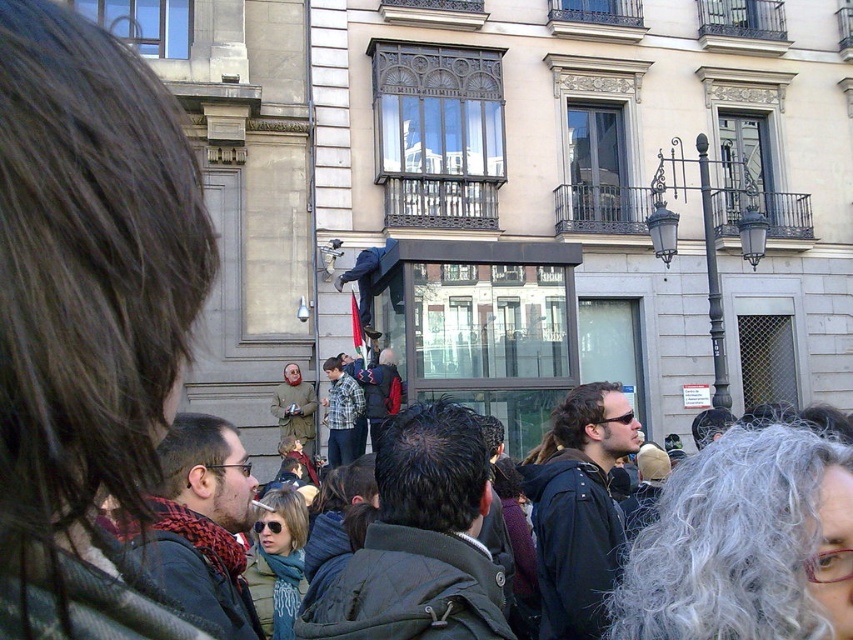
Question: Which point is closer to the camera?

Choices:
 (A) (425, 410)
 (B) (149, 572)
 (C) (399, 381)
 (D) (350, 435)

Answer: (B)

Question: Considering the relative positions of red plaid scarf at lower left and checkered fabric shirt at center in the image provided, where is red plaid scarf at lower left located with respect to checkered fabric shirt at center?

Choices:
 (A) below
 (B) above

Answer: (A)

Question: Does dark brown leather jacket at center appear on the left side of red plaid scarf at lower left?

Choices:
 (A) no
 (B) yes

Answer: (A)

Question: Which object is the closest to the dark brown leather jacket at center?

Choices:
 (A) dark gray jacket at center
 (B) dark blue jacket at center
 (C) checkered fabric shirt at center

Answer: (A)

Question: Which object is the closest to the dark gray jacket at center?

Choices:
 (A) checkered fabric shirt at center
 (B) red plaid scarf at lower left
 (C) dark brown leather jacket at center
 (D) dark blue jacket at center

Answer: (B)

Question: From the image, what is the correct spatial relationship of dark brown leather jacket at center in relation to dark blue jacket at center?

Choices:
 (A) above
 (B) below

Answer: (B)